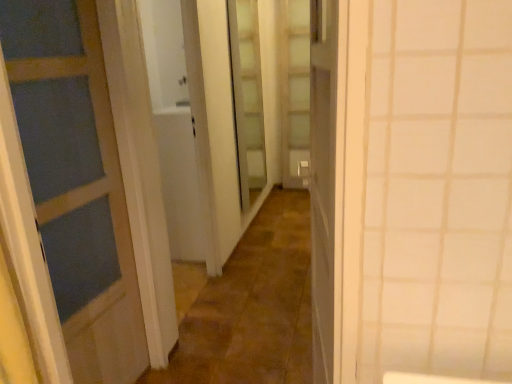
Question: Is brown stone alley at center shorter than translucent glass screen door at center, the second screen door from the front?

Choices:
 (A) no
 (B) yes

Answer: (B)

Question: From the image's perspective, is brown stone alley at center under translucent glass screen door at center, which is counted as the first screen door, starting from the right?

Choices:
 (A) yes
 (B) no

Answer: (A)

Question: Is brown stone alley at center at the right side of translucent glass screen door at center, which is counted as the 2th screen door, starting from the left?

Choices:
 (A) yes
 (B) no

Answer: (B)

Question: Is brown stone alley at center located outside translucent glass screen door at center, the second screen door from the front?

Choices:
 (A) yes
 (B) no

Answer: (A)

Question: Could you tell me if brown stone alley at center is facing translucent glass screen door at center, which is counted as the first screen door, starting from the right?

Choices:
 (A) yes
 (B) no

Answer: (B)

Question: Is point (300, 182) closer or farther from the camera than point (199, 352)?

Choices:
 (A) closer
 (B) farther

Answer: (B)

Question: Considering the positions of translucent glass screen door at center, the second screen door from the front, and brown stone alley at center in the image, is translucent glass screen door at center, the second screen door from the front, taller or shorter than brown stone alley at center?

Choices:
 (A) tall
 (B) short

Answer: (A)

Question: Based on their sizes in the image, would you say translucent glass screen door at center, the 1th screen door from the back, is bigger or smaller than brown stone alley at center?

Choices:
 (A) big
 (B) small

Answer: (B)

Question: Is translucent glass screen door at center, which is counted as the 2th screen door, starting from the left, to the left or to the right of brown stone alley at center in the image?

Choices:
 (A) right
 (B) left

Answer: (A)

Question: Is point (241, 150) closer or farther from the camera than point (307, 127)?

Choices:
 (A) farther
 (B) closer

Answer: (B)

Question: Considering the positions of clear glass door at center, which is the first screen door from front to back, and translucent glass screen door at center, the second screen door from the front, in the image, is clear glass door at center, which is the first screen door from front to back, bigger or smaller than translucent glass screen door at center, the second screen door from the front,?

Choices:
 (A) big
 (B) small

Answer: (A)

Question: In terms of height, does clear glass door at center, the 2th screen door when ordered from back to front, look taller or shorter compared to translucent glass screen door at center, the second screen door from the front?

Choices:
 (A) short
 (B) tall

Answer: (A)

Question: Is clear glass door at center, the 2th screen door when ordered from back to front, in front of or behind translucent glass screen door at center, the second screen door from the front, in the image?

Choices:
 (A) front
 (B) behind

Answer: (A)

Question: In terms of width, does translucent glass screen door at center, the second screen door from the front, look wider or thinner when compared to clear glass door at center, which is the first screen door from front to back?

Choices:
 (A) wide
 (B) thin

Answer: (A)

Question: Considering the positions of point (302, 115) and point (234, 94), is point (302, 115) closer or farther from the camera than point (234, 94)?

Choices:
 (A) closer
 (B) farther

Answer: (B)